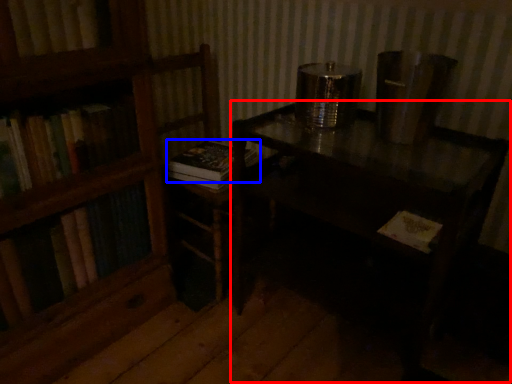
Question: Which object appears farthest to the camera in this image, table (highlighted by a red box) or book (highlighted by a blue box)?

Choices:
 (A) table
 (B) book

Answer: (B)